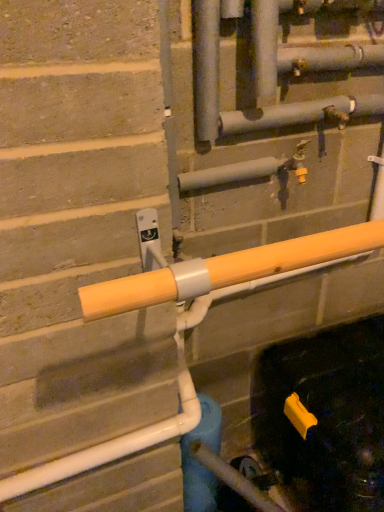
Identify the location of blue matte water pipe at center. (200, 463).

I want to click on yellow matte pipe at center, so click(226, 270).

This screenshot has width=384, height=512. What are the coordinates of `yellow plastic faucet at center` in the screenshot? It's located at (297, 162).

Locate an element on the screen. The height and width of the screenshot is (512, 384). blue matte water pipe at center is located at coordinates (200, 463).

In the image, is blue matte water pipe at center on the left side or the right side of yellow plastic faucet at center?

In the image, blue matte water pipe at center appears on the left side of yellow plastic faucet at center.

In the scene shown: Can you see blue matte water pipe at center touching yellow plastic faucet at center?

No, blue matte water pipe at center is not beside yellow plastic faucet at center.

Is point (205, 413) farther from camera compared to point (285, 162)?

Yes, it is.

Considering the sizes of yellow matte pipe at center and blue matte water pipe at center in the image, is yellow matte pipe at center taller or shorter than blue matte water pipe at center?

yellow matte pipe at center is shorter than blue matte water pipe at center.

Is yellow matte pipe at center inside or outside of blue matte water pipe at center?

yellow matte pipe at center exists outside the volume of blue matte water pipe at center.

Looking at this image, is yellow matte pipe at center at the right side of blue matte water pipe at center?

Yes, yellow matte pipe at center is to the right of blue matte water pipe at center.

From a real-world perspective, is yellow plastic faucet at center physically located above or below blue matte water pipe at center?

In terms of real-world spatial position, yellow plastic faucet at center is above blue matte water pipe at center.

From the image's perspective, which one is positioned higher, yellow plastic faucet at center or blue matte water pipe at center?

From the image's view, yellow plastic faucet at center is above.

Could blue matte water pipe at center be considered to be inside yellow plastic faucet at center?

Actually, blue matte water pipe at center is outside yellow plastic faucet at center.

In the image, is yellow plastic faucet at center on the left side or the right side of blue matte water pipe at center?

From the image, it's evident that yellow plastic faucet at center is to the right of blue matte water pipe at center.

Who is bigger, blue matte water pipe at center or yellow matte pipe at center?

With larger size is yellow matte pipe at center.

From a real-world perspective, who is located lower, blue matte water pipe at center or yellow matte pipe at center?

blue matte water pipe at center, from a real-world perspective.

Measure the distance from blue matte water pipe at center to yellow matte pipe at center.

They are 67.12 centimeters apart.

Is blue matte water pipe at center inside or outside of yellow matte pipe at center?

blue matte water pipe at center is spatially situated outside yellow matte pipe at center.

Is yellow plastic faucet at center in front of or behind yellow matte pipe at center in the image?

Visually, yellow plastic faucet at center is located behind yellow matte pipe at center.

From a real-world perspective, which is physically above, yellow plastic faucet at center or yellow matte pipe at center?

From a 3D spatial view, yellow plastic faucet at center is above.

In terms of width, does yellow plastic faucet at center look wider or thinner when compared to yellow matte pipe at center?

In the image, yellow plastic faucet at center appears to be more narrow than yellow matte pipe at center.

Is yellow matte pipe at center bigger than yellow plastic faucet at center?

Yes.

Between yellow matte pipe at center and yellow plastic faucet at center, which one appears on the left side from the viewer's perspective?

From the viewer's perspective, yellow matte pipe at center appears more on the left side.

Locate an element on the screen. The image size is (384, 512). beam that appears in front of the yellow plastic faucet at center is located at coordinates (226, 270).

Locate an element on the screen. plumbing fixture above the blue matte water pipe at center (from a real-world perspective) is located at coordinates (297, 162).

Image resolution: width=384 pixels, height=512 pixels. I want to click on beam that appears on the right of blue matte water pipe at center, so click(226, 270).

Looking at this image, which object lies nearer to the anchor point blue matte water pipe at center, yellow plastic faucet at center or yellow matte pipe at center?

yellow matte pipe at center is closer to blue matte water pipe at center.

Looking at the image, which one is located closer to yellow plastic faucet at center, yellow matte pipe at center or blue matte water pipe at center?

Among the two, yellow matte pipe at center is located nearer to yellow plastic faucet at center.

Considering their positions, is blue matte water pipe at center positioned further to yellow plastic faucet at center than yellow matte pipe at center?

blue matte water pipe at center.

From the image, which object appears to be nearer to yellow matte pipe at center, blue matte water pipe at center or yellow plastic faucet at center?

Based on the image, yellow plastic faucet at center appears to be nearer to yellow matte pipe at center.

Based on their spatial positions, is yellow plastic faucet at center or blue matte water pipe at center further from yellow matte pipe at center?

blue matte water pipe at center.

Which object lies further to the anchor point blue matte water pipe at center, yellow matte pipe at center or yellow plastic faucet at center?

yellow plastic faucet at center is further to blue matte water pipe at center.

Find the location of a particular element. This screenshot has width=384, height=512. beam between yellow plastic faucet at center and blue matte water pipe at center in the vertical direction is located at coordinates (226, 270).